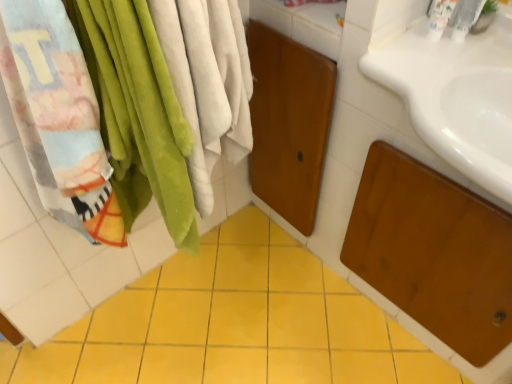
Question: Is yellow ceramic tile at center bigger than white plastic bottle at upper right, positioned as the second toiletry in right-to-left order?

Choices:
 (A) yes
 (B) no

Answer: (A)

Question: Does yellow ceramic tile at center have a greater width compared to white plastic bottle at upper right, positioned as the second toiletry in right-to-left order?

Choices:
 (A) yes
 (B) no

Answer: (A)

Question: Is yellow ceramic tile at center to the right of white plastic bottle at upper right, the first toiletry when ordered from left to right, from the viewer's perspective?

Choices:
 (A) yes
 (B) no

Answer: (B)

Question: Considering the relative positions of yellow ceramic tile at center and white plastic bottle at upper right, the first toiletry when ordered from left to right, in the image provided, is yellow ceramic tile at center to the left of white plastic bottle at upper right, the first toiletry when ordered from left to right, from the viewer's perspective?

Choices:
 (A) no
 (B) yes

Answer: (B)

Question: Is yellow ceramic tile at center positioned with its back to white plastic bottle at upper right, positioned as the second toiletry in right-to-left order?

Choices:
 (A) no
 (B) yes

Answer: (A)

Question: Is yellow ceramic tile at center far from white plastic bottle at upper right, the first toiletry when ordered from left to right?

Choices:
 (A) no
 (B) yes

Answer: (B)

Question: From a real-world perspective, does white plastic faucet at upper right, the first toiletry positioned from the right, sit lower than yellow ceramic tile at center?

Choices:
 (A) no
 (B) yes

Answer: (A)

Question: From a real-world perspective, is white plastic faucet at upper right, the first toiletry positioned from the right, on yellow ceramic tile at center?

Choices:
 (A) yes
 (B) no

Answer: (A)

Question: Is white plastic faucet at upper right, placed as the 2th toiletry when sorted from left to right, outside yellow ceramic tile at center?

Choices:
 (A) no
 (B) yes

Answer: (B)

Question: From the image's perspective, is white plastic faucet at upper right, the first toiletry positioned from the right, under yellow ceramic tile at center?

Choices:
 (A) no
 (B) yes

Answer: (A)

Question: Can you confirm if white plastic faucet at upper right, placed as the 2th toiletry when sorted from left to right, is bigger than yellow ceramic tile at center?

Choices:
 (A) yes
 (B) no

Answer: (B)

Question: Is white plastic faucet at upper right, placed as the 2th toiletry when sorted from left to right, wider than yellow ceramic tile at center?

Choices:
 (A) no
 (B) yes

Answer: (A)

Question: Considering the relative sizes of white plastic faucet at upper right, the first toiletry positioned from the right, and white plastic bottle at upper right, the first toiletry when ordered from left to right, in the image provided, is white plastic faucet at upper right, the first toiletry positioned from the right, bigger than white plastic bottle at upper right, the first toiletry when ordered from left to right,?

Choices:
 (A) no
 (B) yes

Answer: (A)